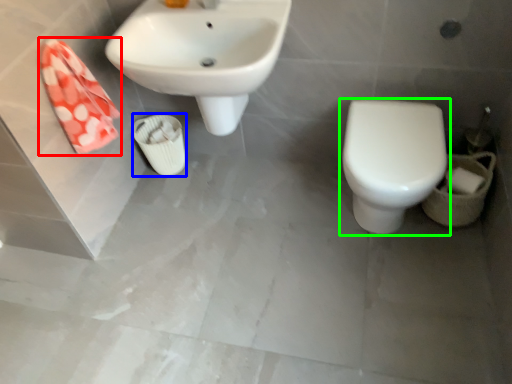
Question: Based on their relative distances, which object is nearer to hand towel (highlighted by a red box)? Choose from porcelain (highlighted by a blue box) and toilet (highlighted by a green box).

Choices:
 (A) porcelain
 (B) toilet

Answer: (A)